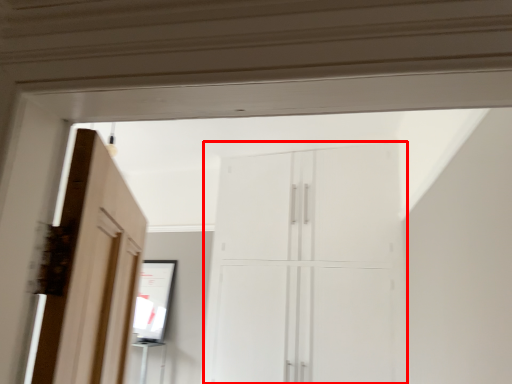
Question: Considering the relative positions of cupboard (annotated by the red box) and mirror in the image provided, where is cupboard (annotated by the red box) located with respect to the staircase?

Choices:
 (A) right
 (B) left

Answer: (A)